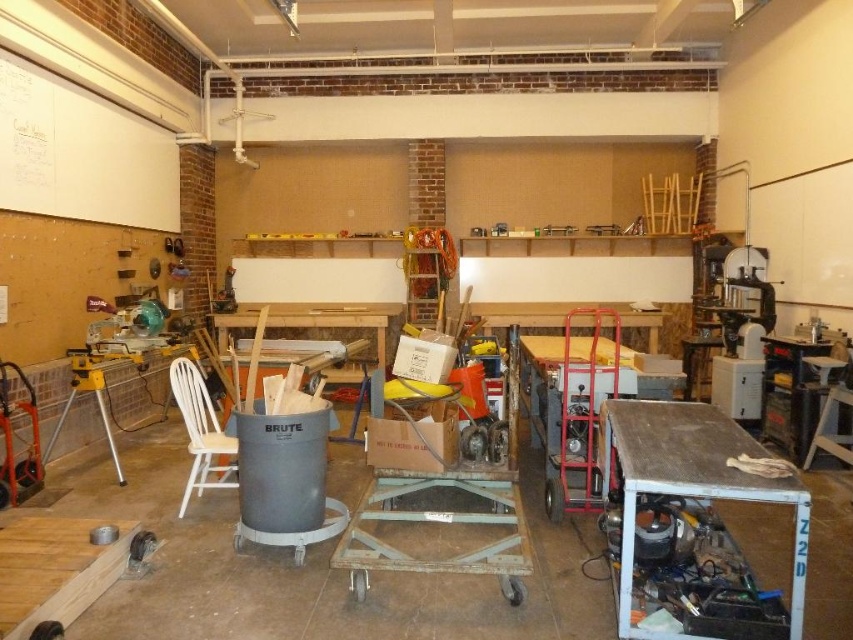
You are a delivery person who needs to place a package that is 2 meters long between the white matte bulletin board at upper left and the white wood chair at left. Can you fit the package horizontally between them without moving either object?

The distance between the white matte bulletin board at upper left and the white wood chair at left is 2.14 meters. Since the package is 2 meters long, it can fit horizontally between them as there is enough space.